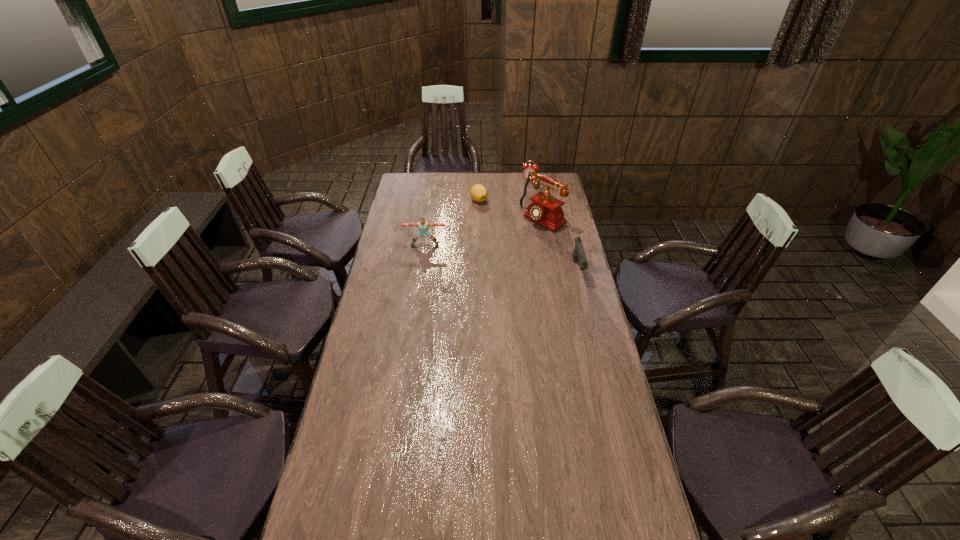
Where is `alarm clock located in the far edge section of the desktop`? The width and height of the screenshot is (960, 540). alarm clock located in the far edge section of the desktop is located at coordinates (527, 168).

In order to click on object at the left edge in this screenshot , I will do `click(423, 225)`.

The width and height of the screenshot is (960, 540). I want to click on pistol that is positioned at the right edge, so click(578, 254).

The image size is (960, 540). I want to click on alarm clock that is at the right edge, so click(527, 168).

This screenshot has width=960, height=540. I want to click on telephone at the right edge, so click(546, 210).

Locate an element on the screen. object at the far right corner is located at coordinates (527, 168).

Where is `vacant space at the far edge of the desktop`? The height and width of the screenshot is (540, 960). vacant space at the far edge of the desktop is located at coordinates (457, 190).

This screenshot has height=540, width=960. In the image, there is a desktop. Find the location of `blank space at the near edge`. blank space at the near edge is located at coordinates click(523, 510).

This screenshot has height=540, width=960. I want to click on free space at the left edge, so click(x=387, y=239).

At what (x,y) coordinates should I click in order to perform the action: click on vacant point at the right edge. Please return your answer as a coordinate pair (x, y). The width and height of the screenshot is (960, 540). Looking at the image, I should click on (557, 195).